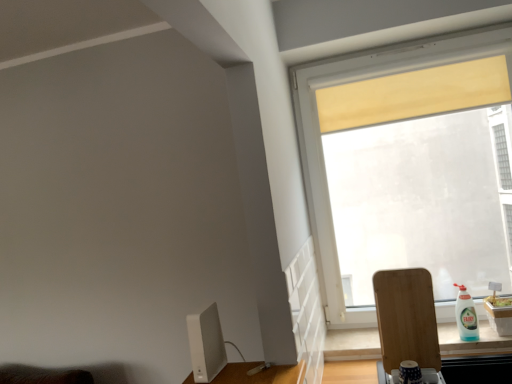
Identify the location of transparent glass window at upper right. The height and width of the screenshot is (384, 512). (322, 145).

Measure the distance between point (460, 333) and camera.

The depth of point (460, 333) is 6.66 feet.

Identify the location of transparent glass window at upper right. (322, 145).

Image resolution: width=512 pixels, height=384 pixels. I want to click on window above the white matte computer monitor at lower left (from the image's perspective), so click(x=322, y=145).

In terms of size, does white matte computer monitor at lower left appear bigger or smaller than transparent glass window at upper right?

Clearly, white matte computer monitor at lower left is smaller in size than transparent glass window at upper right.

Is white matte computer monitor at lower left closer to the viewer compared to transparent glass window at upper right?

Yes, it is.

From the image's perspective, between white matte computer monitor at lower left and transparent glass window at upper right, which one is located above?

transparent glass window at upper right, from the image's perspective.

Considering the relative sizes of transparent glass window at upper right and wooden cutting board at lower right in the image provided, is transparent glass window at upper right wider than wooden cutting board at lower right?

Yes, transparent glass window at upper right is wider than wooden cutting board at lower right.

Is there a large distance between transparent glass window at upper right and wooden cutting board at lower right?

No, transparent glass window at upper right is in close proximity to wooden cutting board at lower right.

From the image's perspective, which object appears higher, transparent glass window at upper right or wooden cutting board at lower right?

transparent glass window at upper right is shown above in the image.

Is transparent glass window at upper right looking in the opposite direction of wooden cutting board at lower right?

No, transparent glass window at upper right is not facing the opposite direction of wooden cutting board at lower right.

Is white matte computer monitor at lower left thinner than white plastic bottle at right?

No, white matte computer monitor at lower left is not thinner than white plastic bottle at right.

How different are the orientations of white matte computer monitor at lower left and white plastic bottle at right in degrees?

white matte computer monitor at lower left and white plastic bottle at right are facing 7.83 degrees away from each other.

From a real-world perspective, relative to white plastic bottle at right, is white matte computer monitor at lower left vertically above or below?

From a real-world perspective, white matte computer monitor at lower left is physically above white plastic bottle at right.

Which is nearer, (x=192, y=333) or (x=478, y=337)?

Point (x=192, y=333).

Is white plastic bottle at right far away from transparent glass window at upper right?

white plastic bottle at right is actually quite close to transparent glass window at upper right.

Is white plastic bottle at right at the right side of transparent glass window at upper right?

Indeed, white plastic bottle at right is positioned on the right side of transparent glass window at upper right.

Is point (464, 315) positioned behind point (302, 130)?

No, it is in front of (302, 130).

From the image's perspective, which one is positioned lower, white plastic bottle at right or transparent glass window at upper right?

white plastic bottle at right appears lower in the image.

Find the location of a particular element. Image resolution: width=512 pixels, height=384 pixels. swivel chair behind the white matte computer monitor at lower left is located at coordinates (406, 317).

From their relative heights in the image, would you say wooden cutting board at lower right is taller or shorter than white matte computer monitor at lower left?

wooden cutting board at lower right is taller than white matte computer monitor at lower left.

In the scene shown: What's the angular difference between wooden cutting board at lower right and white matte computer monitor at lower left's facing directions?

9.72 degrees separate the facing orientations of wooden cutting board at lower right and white matte computer monitor at lower left.

Can you tell me how much wooden cutting board at lower right and white plastic bottle at right differ in facing direction?

1.9 degrees separate the facing orientations of wooden cutting board at lower right and white plastic bottle at right.

Looking at this image, considering the positions of objects wooden cutting board at lower right and white plastic bottle at right in the image provided, who is more to the left, wooden cutting board at lower right or white plastic bottle at right?

Positioned to the left is wooden cutting board at lower right.

In terms of width, does wooden cutting board at lower right look wider or thinner when compared to white plastic bottle at right?

Considering their sizes, wooden cutting board at lower right looks slimmer than white plastic bottle at right.

Would you consider wooden cutting board at lower right to be distant from white plastic bottle at right?

No, there isn't a large distance between wooden cutting board at lower right and white plastic bottle at right.

Does wooden cutting board at lower right have a lesser height compared to transparent glass window at upper right?

Correct, wooden cutting board at lower right is not as tall as transparent glass window at upper right.

Can you tell me how much wooden cutting board at lower right and transparent glass window at upper right differ in facing direction?

The angular difference between wooden cutting board at lower right and transparent glass window at upper right is 0.00383 degrees.

Does point (407, 298) appear closer or farther from the camera than point (316, 125)?

Point (407, 298) is positioned closer to the camera compared to point (316, 125).

Which is correct: wooden cutting board at lower right is inside transparent glass window at upper right, or outside of it?

wooden cutting board at lower right is spatially situated outside transparent glass window at upper right.

This screenshot has height=384, width=512. I want to click on computer monitor on the left of transparent glass window at upper right, so click(206, 344).

Where is `swivel chair below the transparent glass window at upper right (from a real-world perspective)`? swivel chair below the transparent glass window at upper right (from a real-world perspective) is located at coordinates (406, 317).

Looking at this image, from the image, which object appears to be farther from white plastic bottle at right, white matte computer monitor at lower left or transparent glass window at upper right?

Among the two, white matte computer monitor at lower left is located further to white plastic bottle at right.

When comparing their distances from transparent glass window at upper right, does white plastic bottle at right or wooden cutting board at lower right seem further?

Based on the image, white plastic bottle at right appears to be further to transparent glass window at upper right.

Which object lies further to the anchor point white matte computer monitor at lower left, white plastic bottle at right or wooden cutting board at lower right?

white plastic bottle at right is further to white matte computer monitor at lower left.

Based on their spatial positions, is white matte computer monitor at lower left or white plastic bottle at right closer to transparent glass window at upper right?

white plastic bottle at right lies closer to transparent glass window at upper right than the other object.

Looking at the image, which one is located further to white matte computer monitor at lower left, white plastic bottle at right or transparent glass window at upper right?

white plastic bottle at right lies further to white matte computer monitor at lower left than the other object.

Looking at the image, which one is located further to wooden cutting board at lower right, transparent glass window at upper right or white matte computer monitor at lower left?

Based on the image, white matte computer monitor at lower left appears to be further to wooden cutting board at lower right.

Considering their positions, is transparent glass window at upper right positioned closer to wooden cutting board at lower right than white plastic bottle at right?

white plastic bottle at right.

Looking at the image, which one is located closer to white plastic bottle at right, white matte computer monitor at lower left or wooden cutting board at lower right?

wooden cutting board at lower right is closer to white plastic bottle at right.

The image size is (512, 384). What are the coordinates of `swivel chair between transparent glass window at upper right and white plastic bottle at right vertically` in the screenshot? It's located at (406, 317).

I want to click on swivel chair between white matte computer monitor at lower left and transparent glass window at upper right, so click(406, 317).

This screenshot has height=384, width=512. I want to click on swivel chair situated between white matte computer monitor at lower left and white plastic bottle at right from left to right, so click(406, 317).

Where is `window between white matte computer monitor at lower left and white plastic bottle at right in the horizontal direction`? window between white matte computer monitor at lower left and white plastic bottle at right in the horizontal direction is located at coordinates (322, 145).